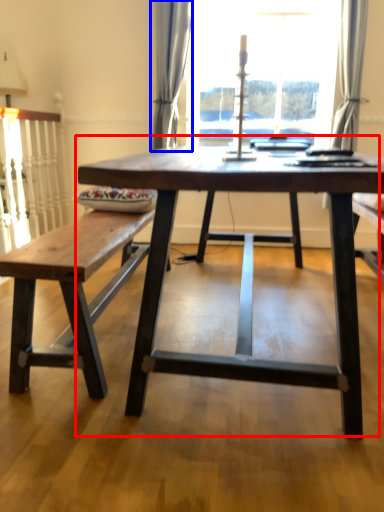
Question: Which of the following is the farthest to the observer, coffee table (highlighted by a red box) or curtain (highlighted by a blue box)?

Choices:
 (A) coffee table
 (B) curtain

Answer: (B)